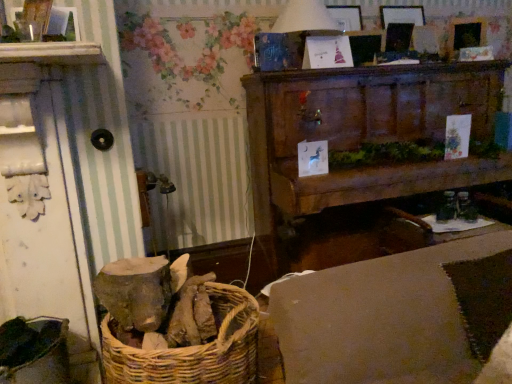
Question: Does white paper lampshade at upper center appear on the left side of beige fabric couch at lower right?

Choices:
 (A) no
 (B) yes

Answer: (B)

Question: From the image's perspective, would you say white paper lampshade at upper center is positioned over beige fabric couch at lower right?

Choices:
 (A) yes
 (B) no

Answer: (A)

Question: Can you confirm if white paper lampshade at upper center is shorter than beige fabric couch at lower right?

Choices:
 (A) no
 (B) yes

Answer: (B)

Question: Considering the relative sizes of white paper lampshade at upper center and beige fabric couch at lower right in the image provided, is white paper lampshade at upper center smaller than beige fabric couch at lower right?

Choices:
 (A) yes
 (B) no

Answer: (A)

Question: Is white paper lampshade at upper center closer to camera compared to beige fabric couch at lower right?

Choices:
 (A) no
 (B) yes

Answer: (A)

Question: From a real-world perspective, is white paper lampshade at upper center on top of beige fabric couch at lower right?

Choices:
 (A) yes
 (B) no

Answer: (A)

Question: Is beige fabric couch at lower right wider than white paper lampshade at upper center?

Choices:
 (A) yes
 (B) no

Answer: (A)

Question: Is beige fabric couch at lower right taller than white paper lampshade at upper center?

Choices:
 (A) no
 (B) yes

Answer: (B)

Question: Is beige fabric couch at lower right positioned before white paper lampshade at upper center?

Choices:
 (A) no
 (B) yes

Answer: (B)

Question: Is beige fabric couch at lower right at the right side of white paper lampshade at upper center?

Choices:
 (A) no
 (B) yes

Answer: (B)

Question: Are beige fabric couch at lower right and white paper lampshade at upper center far apart?

Choices:
 (A) yes
 (B) no

Answer: (A)

Question: Is beige fabric couch at lower right oriented away from white paper lampshade at upper center?

Choices:
 (A) yes
 (B) no

Answer: (B)

Question: Can you confirm if wooden cabinet at upper center is positioned to the left of beige fabric couch at lower right?

Choices:
 (A) no
 (B) yes

Answer: (A)